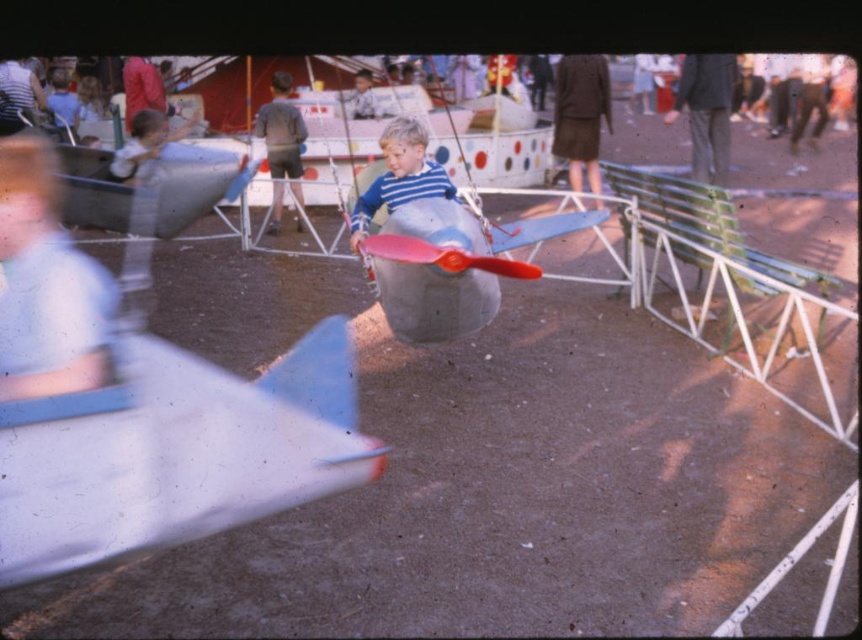
Question: Which point is farther to the camera?

Choices:
 (A) metallic silver airplane at center
 (B) matte plastic toy airplane at center

Answer: (B)

Question: Is metallic silver airplane at center thinner than matte plastic toy airplane at center?

Choices:
 (A) yes
 (B) no

Answer: (B)

Question: Can you confirm if metallic silver airplane at center is bigger than matte plastic toy airplane at center?

Choices:
 (A) no
 (B) yes

Answer: (B)

Question: Which object is farther from the camera taking this photo?

Choices:
 (A) matte plastic toy airplane at center
 (B) metallic silver airplane at center

Answer: (A)

Question: Among these objects, which one is nearest to the camera?

Choices:
 (A) matte plastic toy airplane at center
 (B) metallic silver airplane at center

Answer: (B)

Question: Is metallic silver airplane at center thinner than matte plastic toy airplane at center?

Choices:
 (A) yes
 (B) no

Answer: (B)